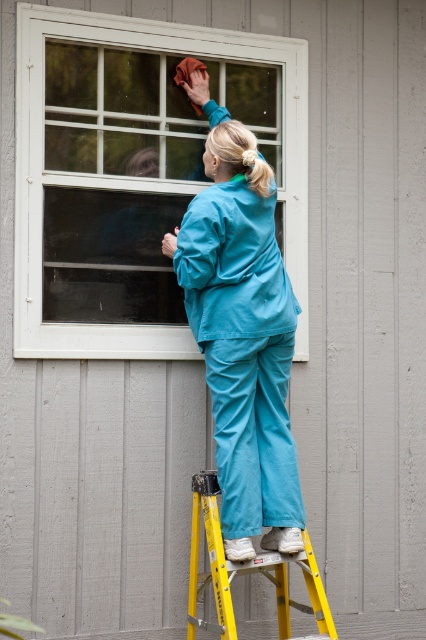
Does teal fabric pants at center have a greater width compared to yellow metallic ladder at lower center?

In fact, teal fabric pants at center might be narrower than yellow metallic ladder at lower center.

Between teal fabric pants at center and yellow metallic ladder at lower center, which one appears on the left side from the viewer's perspective?

teal fabric pants at center

Describe the element at coordinates (242, 337) in the screenshot. I see `teal fabric pants at center` at that location.

Image resolution: width=426 pixels, height=640 pixels. What are the coordinates of `teal fabric pants at center` in the screenshot? It's located at (242, 337).

Who is higher up, white matte window at upper center or yellow metallic ladder at lower center?

Positioned higher is white matte window at upper center.

Between point (25, 122) and point (316, 605), which one is positioned behind?

Point (25, 122)

The height and width of the screenshot is (640, 426). Find the location of `white matte window at upper center`. white matte window at upper center is located at coordinates (135, 172).

Who is positioned more to the left, white matte window at upper center or teal fabric pants at center?

From the viewer's perspective, white matte window at upper center appears more on the left side.

Which is above, white matte window at upper center or teal fabric pants at center?

white matte window at upper center

Is point (132, 141) behind point (221, 316)?

Yes, point (132, 141) is farther from viewer.

Locate an element on the screen. This screenshot has width=426, height=640. white matte window at upper center is located at coordinates (135, 172).